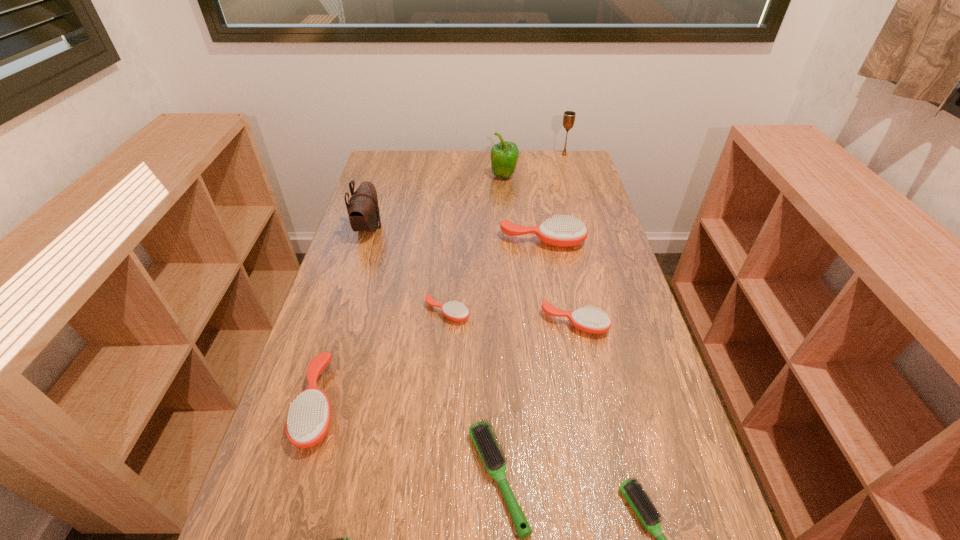
At what (x,y) coordinates should I click in order to perform the action: click on orange hairbrush that can be found as the closest to the bell pepper. Please return your answer as a coordinate pair (x, y). Image resolution: width=960 pixels, height=540 pixels. Looking at the image, I should click on (563, 231).

You are a GUI agent. You are given a task and a screenshot of the screen. Output one action in this format:
    pyautogui.click(x=<x>, y=<y>)
    Task: Click on the light hairbrush that is the second closest one to the fifth shortest object
    This screenshot has height=540, width=960.
    Given the screenshot: What is the action you would take?
    pyautogui.click(x=641, y=504)

Locate which light hairbrush is the closest to the second biggest orange hairbrush. Please provide its 2D coordinates. Your answer should be formatted as a tuple, i.e. [(x, y)], where the tuple contains the x and y coordinates of a point satisfying the conditions above.

[(341, 539)]

Identify the location of free spot that satisfies the following two spatial constraints: 1. on the front side of the second smallest orange hairbrush; 2. on the left side of the third hairbrush from left to right. (446, 323).

Find the location of `vacant region that satisfies the following two spatial constraints: 1. on the back side of the fifth shortest hairbrush; 2. on the left side of the farthest object`. vacant region that satisfies the following two spatial constraints: 1. on the back side of the fifth shortest hairbrush; 2. on the left side of the farthest object is located at coordinates (540, 154).

Where is `vacant space that satisfies the following two spatial constraints: 1. with the flap open on the farthest hairbrush; 2. on the left side of the brown pouch`? The width and height of the screenshot is (960, 540). vacant space that satisfies the following two spatial constraints: 1. with the flap open on the farthest hairbrush; 2. on the left side of the brown pouch is located at coordinates (365, 241).